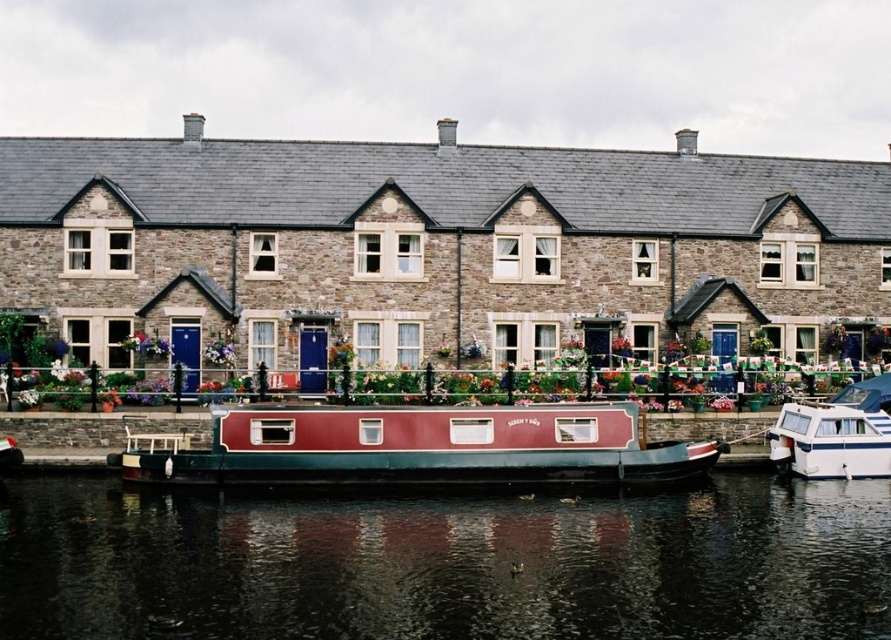
Is point (156, 602) positioned before point (525, 408)?

Yes, it is.

Find the location of a particular element. smooth dark water at center is located at coordinates (446, 564).

Between maroon polished wood barge at center and white glossy boat at lower right, which one has less height?

maroon polished wood barge at center

You are a GUI agent. You are given a task and a screenshot of the screen. Output one action in this format:
    pyautogui.click(x=<x>, y=<y>)
    Task: Click on the maroon polished wood barge at center
    This screenshot has width=891, height=640.
    Given the screenshot: What is the action you would take?
    pyautogui.click(x=419, y=448)

Where is `maroon polished wood barge at center`? The width and height of the screenshot is (891, 640). maroon polished wood barge at center is located at coordinates (419, 448).

Between smooth dark water at center and white glossy boat at lower right, which one appears on the right side from the viewer's perspective?

white glossy boat at lower right

Does smooth dark water at center have a lesser height compared to white glossy boat at lower right?

Yes.

The width and height of the screenshot is (891, 640). What are the coordinates of `smooth dark water at center` in the screenshot? It's located at (446, 564).

Where is `smooth dark water at center`? The image size is (891, 640). smooth dark water at center is located at coordinates (446, 564).